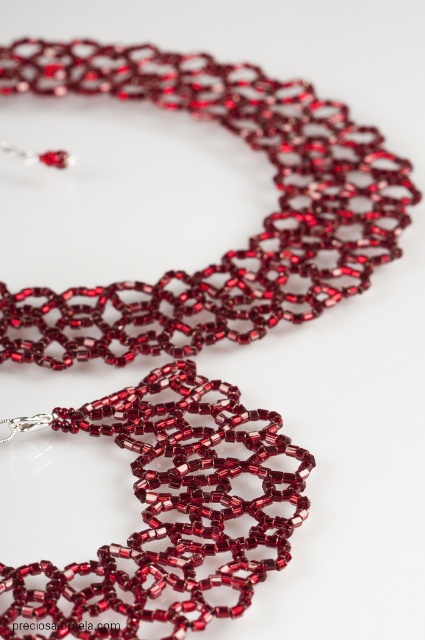
You are holding a camera and want to take a closeup photo of the matte glass necklace at upper center. If the camera is currently 1.35 meters away from the necklace, is this distance suitable for a closeup shot?

The matte glass necklace at upper center and camera are 1.35 meters apart from each other. This distance may be too far for a closeup shot, as closeups typically require being much closer to the subject to capture fine details.

You are holding a magnifying glass to examine the intricate details of the jewelry set. The point at coordinates point (340,196) is part of the necklace or bracelet. Which one is closer to you?

The point at coordinates point (340,196) is 5.17 feet from the viewer, so it is closer to you than the other parts of the jewelry set.

You are an appraiser examining the jewelry set. You notice two pieces, the matte glass necklace at upper center and the matte glass beaded necklace at center. Which one is positioned closer to the front of the image?

The matte glass beaded necklace at center is behind the matte glass necklace at upper center, so the matte glass necklace at upper center is closer to the front.